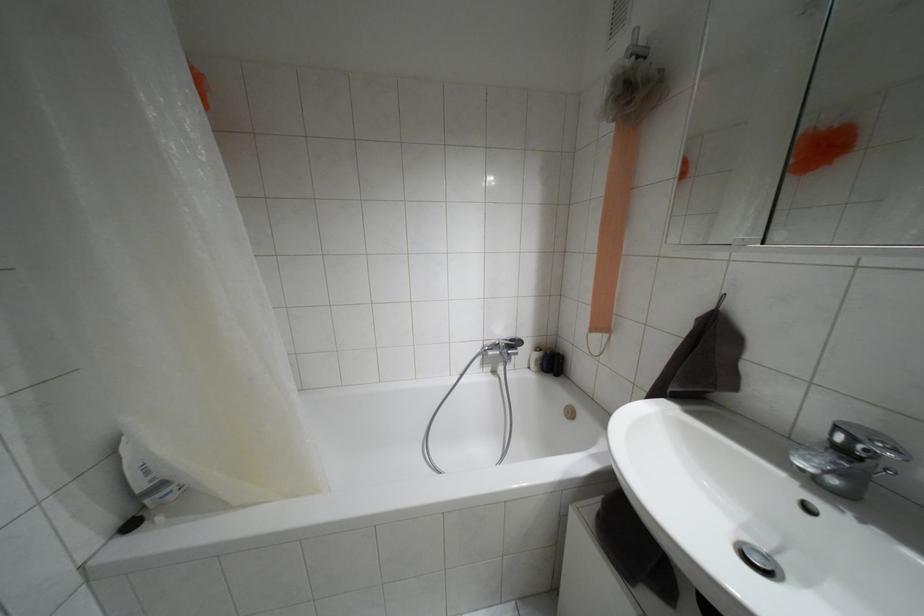
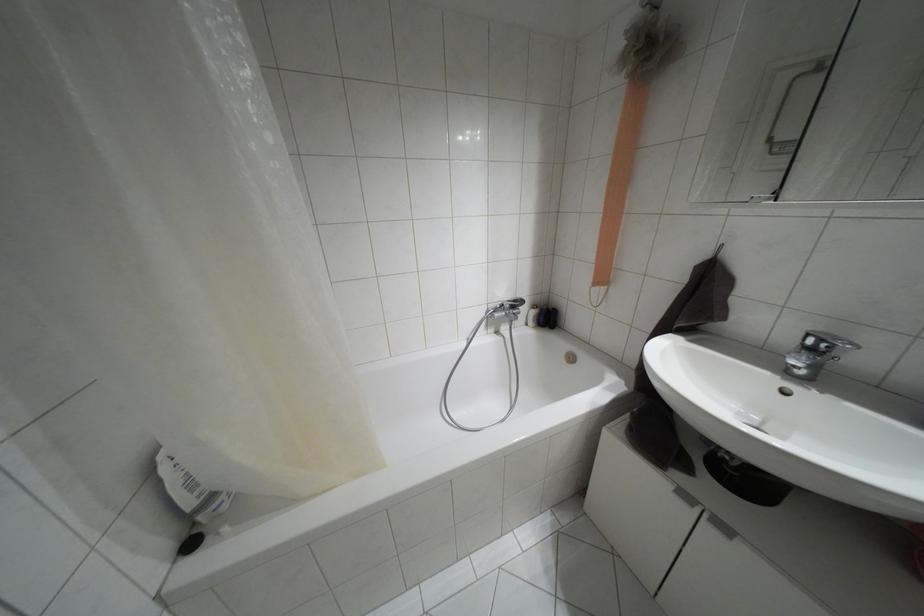
Find the pixel in the second image that matches point (552, 363) in the first image.

(546, 317)